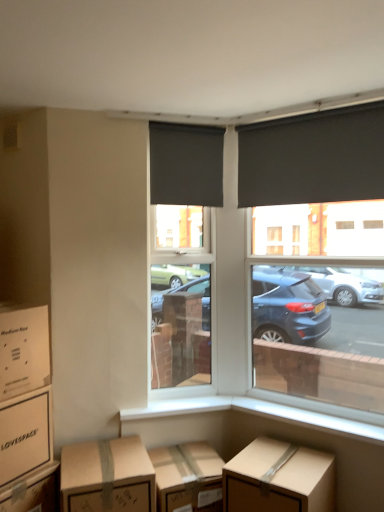
Question: Does matte black roller blind at center have a lesser width compared to black roller blind at upper right?

Choices:
 (A) no
 (B) yes

Answer: (A)

Question: Is matte black roller blind at center in front of black roller blind at upper right?

Choices:
 (A) yes
 (B) no

Answer: (B)

Question: Is matte black roller blind at center next to black roller blind at upper right?

Choices:
 (A) no
 (B) yes

Answer: (A)

Question: Is matte black roller blind at center further to the viewer compared to black roller blind at upper right?

Choices:
 (A) yes
 (B) no

Answer: (A)

Question: From the image's perspective, is matte black roller blind at center located above black roller blind at upper right?

Choices:
 (A) no
 (B) yes

Answer: (A)

Question: From a real-world perspective, is matte black roller blind at center located higher than black roller blind at upper right?

Choices:
 (A) yes
 (B) no

Answer: (B)

Question: Is the depth of brown cardboard box at lower center less than that of brown cardboard box at lower left, positioned as the 3th box in left-to-right order?

Choices:
 (A) yes
 (B) no

Answer: (B)

Question: Is brown cardboard box at lower center at the right side of brown cardboard box at lower left, positioned as the 3th box in left-to-right order?

Choices:
 (A) no
 (B) yes

Answer: (B)

Question: From the image's perspective, does brown cardboard box at lower center appear lower than brown cardboard box at lower left, acting as the third box starting from the right?

Choices:
 (A) no
 (B) yes

Answer: (B)

Question: Would you say brown cardboard box at lower center is outside brown cardboard box at lower left, acting as the third box starting from the right?

Choices:
 (A) no
 (B) yes

Answer: (B)

Question: Is brown cardboard box at lower left, positioned as the 3th box in left-to-right order, surrounded by brown cardboard box at lower center?

Choices:
 (A) no
 (B) yes

Answer: (A)

Question: Does brown cardboard box at lower center have a lesser width compared to brown cardboard box at lower left, positioned as the 3th box in left-to-right order?

Choices:
 (A) yes
 (B) no

Answer: (A)

Question: Considering the relative sizes of brown cardboard box at lower center, which ranks as the fifth box in left-to-right order, and brown cardboard box at lower left, positioned as the 3th box in left-to-right order, in the image provided, is brown cardboard box at lower center, which ranks as the fifth box in left-to-right order, thinner than brown cardboard box at lower left, positioned as the 3th box in left-to-right order,?

Choices:
 (A) no
 (B) yes

Answer: (B)